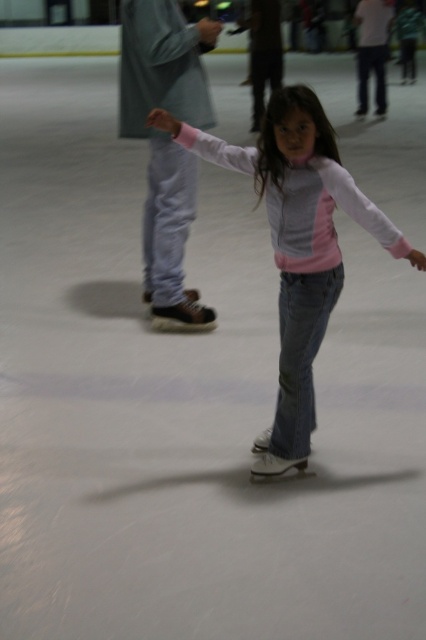
You are a photographer standing at the entrance of the ice rink. You want to capture a photo that includes both the pink matte jacket at center and the matte brown skate at left. The camera you are using has a maximum focus range of 1.5 meters. Will you be able to take the photo with both objects in focus?

The pink matte jacket at center and the matte brown skate at left are 1.20 meters apart, which is within the camera maximum focus range of 1.5 meters. Therefore, you can take the photo with both objects in focus.